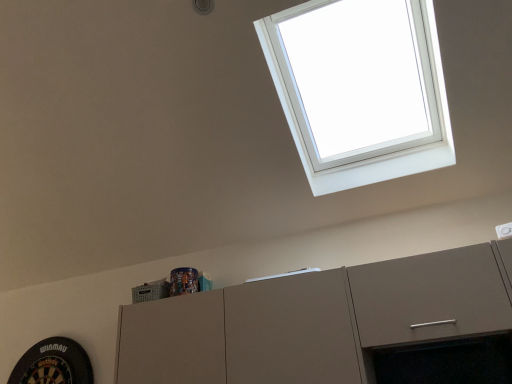
The height and width of the screenshot is (384, 512). What are the coordinates of `white plastic window at upper right` in the screenshot? It's located at (360, 89).

The image size is (512, 384). What do you see at coordinates (360, 89) in the screenshot?
I see `white plastic window at upper right` at bounding box center [360, 89].

This screenshot has height=384, width=512. Describe the element at coordinates (315, 320) in the screenshot. I see `matte gray cabinet at upper center` at that location.

Find the location of a particular element. Image resolution: width=512 pixels, height=384 pixels. matte gray cabinet at upper center is located at coordinates (315, 320).

This screenshot has width=512, height=384. I want to click on white plastic window at upper right, so click(x=360, y=89).

Considering the positions of objects matte gray cabinet at upper center and white plastic window at upper right in the image provided, who is more to the left, matte gray cabinet at upper center or white plastic window at upper right?

matte gray cabinet at upper center.

Is matte gray cabinet at upper center further to camera compared to white plastic window at upper right?

Yes.

Which is closer to the camera, (428, 318) or (408, 85)?

Point (428, 318) is closer to the camera than point (408, 85).

From the image's perspective, is matte gray cabinet at upper center positioned above or below white plastic window at upper right?

matte gray cabinet at upper center is below white plastic window at upper right.

From a real-world perspective, between matte gray cabinet at upper center and white plastic window at upper right, who is vertically lower?

matte gray cabinet at upper center.

From the picture: Which of these two, matte gray cabinet at upper center or white plastic window at upper right, is thinner?

With smaller width is matte gray cabinet at upper center.

Does matte gray cabinet at upper center have a greater height compared to white plastic window at upper right?

In fact, matte gray cabinet at upper center may be shorter than white plastic window at upper right.

Looking at the image, does matte gray cabinet at upper center seem bigger or smaller compared to white plastic window at upper right?

matte gray cabinet at upper center is smaller than white plastic window at upper right.

Would you say matte gray cabinet at upper center contains white plastic window at upper right?

No, white plastic window at upper right is not surrounded by matte gray cabinet at upper center.

Based on the photo, can you see matte gray cabinet at upper center touching white plastic window at upper right?

matte gray cabinet at upper center and white plastic window at upper right are not in contact.

Is matte gray cabinet at upper center facing towards white plastic window at upper right?

No, matte gray cabinet at upper center is not aimed at white plastic window at upper right.

How many degrees apart are the facing directions of matte gray cabinet at upper center and white plastic window at upper right?

There is a 1.14-degree angle between the facing directions of matte gray cabinet at upper center and white plastic window at upper right.

Measure the distance from matte gray cabinet at upper center to white plastic window at upper right.

matte gray cabinet at upper center and white plastic window at upper right are 6.23 feet apart from each other.

Identify the location of cabinetry below the white plastic window at upper right (from a real-world perspective). (315, 320).

Can you confirm if white plastic window at upper right is positioned to the left of matte gray cabinet at upper center?

Incorrect, white plastic window at upper right is not on the left side of matte gray cabinet at upper center.

Is the depth of white plastic window at upper right greater than that of matte gray cabinet at upper center?

No, white plastic window at upper right is closer to the viewer.

Is point (303, 54) positioned in front of point (482, 320)?

No, (303, 54) is behind (482, 320).

From the image's perspective, is white plastic window at upper right positioned above or below matte gray cabinet at upper center?

Based on their image positions, white plastic window at upper right is located above matte gray cabinet at upper center.

From a real-world perspective, is white plastic window at upper right physically located above or below matte gray cabinet at upper center?

Clearly, from a real-world perspective, white plastic window at upper right is above matte gray cabinet at upper center.

Does white plastic window at upper right have a greater width compared to matte gray cabinet at upper center?

Correct, the width of white plastic window at upper right exceeds that of matte gray cabinet at upper center.

Looking at this image, who is taller, white plastic window at upper right or matte gray cabinet at upper center?

white plastic window at upper right is taller.

Does white plastic window at upper right have a larger size compared to matte gray cabinet at upper center?

Indeed, white plastic window at upper right has a larger size compared to matte gray cabinet at upper center.

Is white plastic window at upper right inside or outside of matte gray cabinet at upper center?

white plastic window at upper right is located beyond the bounds of matte gray cabinet at upper center.

Is there a large distance between white plastic window at upper right and matte gray cabinet at upper center?

Yes, white plastic window at upper right is far from matte gray cabinet at upper center.

Is white plastic window at upper right turned away from matte gray cabinet at upper center?

No, white plastic window at upper right is not facing away from matte gray cabinet at upper center.

Measure the distance from white plastic window at upper right to matte gray cabinet at upper center.

They are 1.90 meters apart.

This screenshot has height=384, width=512. What are the coordinates of `cabinetry located underneath the white plastic window at upper right (from a real-world perspective)` in the screenshot? It's located at (315, 320).

Find the location of a particular element. cabinetry behind the white plastic window at upper right is located at coordinates (315, 320).

The image size is (512, 384). I want to click on window in front of the matte gray cabinet at upper center, so click(360, 89).